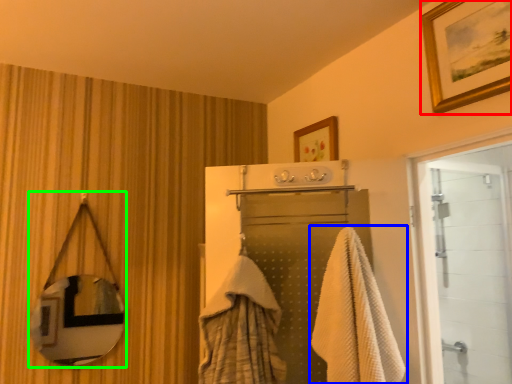
Question: Based on their relative distances, which object is nearer to picture frame (highlighted by a red box)? Choose from towel (highlighted by a blue box) and mirror (highlighted by a green box).

Choices:
 (A) towel
 (B) mirror

Answer: (A)